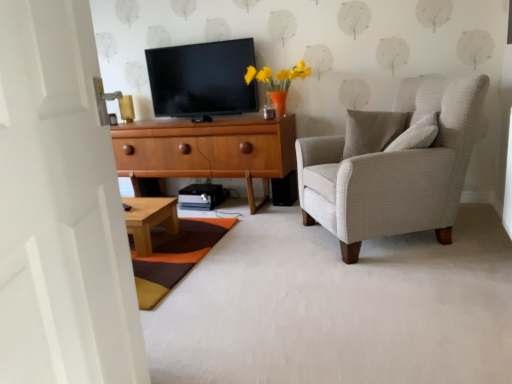
The image size is (512, 384). Find the location of `empty space that is to the right of light wood/texture coffee table at lower left`. empty space that is to the right of light wood/texture coffee table at lower left is located at coordinates (202, 234).